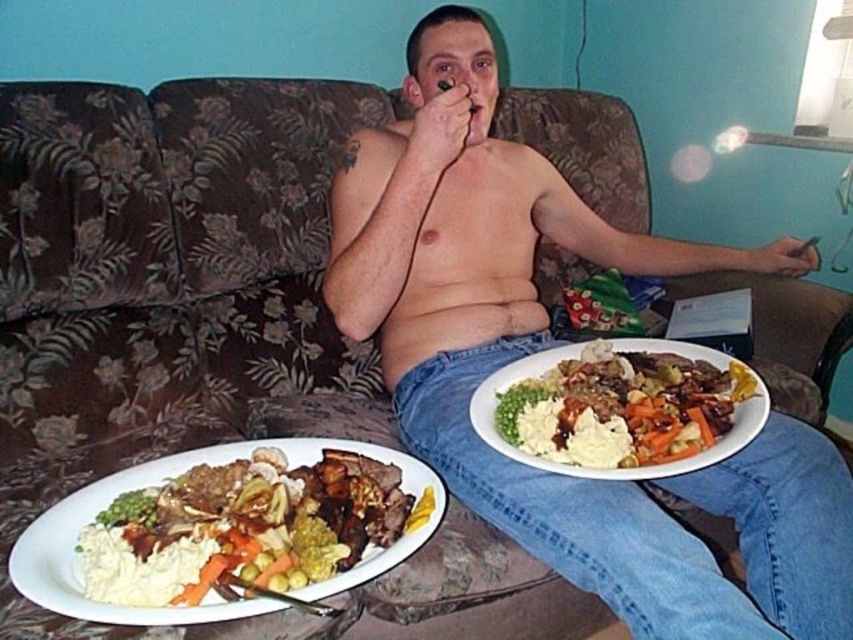
Question: Which is nearer to the smooth skin torso at center?

Choices:
 (A) white creamy mashed potatoes at lower left
 (B) smooth white plate at lower center

Answer: (B)

Question: Can you confirm if smooth skin torso at center is bigger than white creamy mashed potatoes at lower left?

Choices:
 (A) no
 (B) yes

Answer: (B)

Question: Is the position of white creamy mashed potatoes at lower left more distant than that of smooth white plate at lower center?

Choices:
 (A) no
 (B) yes

Answer: (A)

Question: Is smooth skin torso at center thinner than smooth white plate at lower center?

Choices:
 (A) no
 (B) yes

Answer: (A)

Question: Which of the following is the farthest from the observer?

Choices:
 (A) (848, 636)
 (B) (641, 474)

Answer: (A)

Question: Which is farther from the smooth skin torso at center?

Choices:
 (A) smooth white plate at lower center
 (B) white creamy mashed potatoes at lower left

Answer: (B)